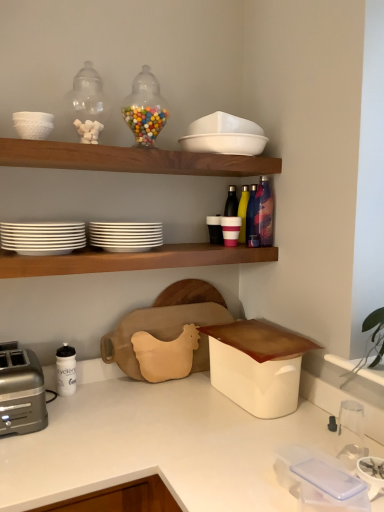
This screenshot has width=384, height=512. I want to click on free point to the left of white matte cup at center, which appears as the fourth tableware when viewed from the top, so click(194, 245).